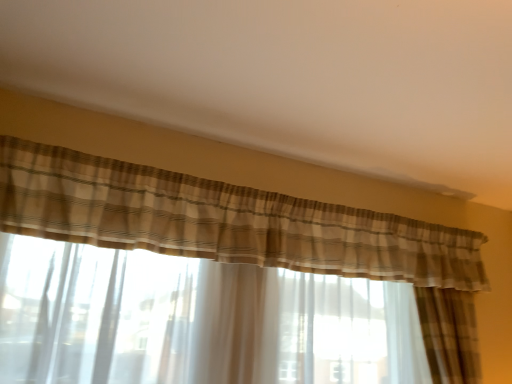
What do you see at coordinates (245, 232) in the screenshot? The height and width of the screenshot is (384, 512). I see `striped fabric curtain at center` at bounding box center [245, 232].

At what (x,y) coordinates should I click in order to perform the action: click on striped fabric curtain at center. Please return your answer as a coordinate pair (x, y). This screenshot has width=512, height=384. Looking at the image, I should click on (245, 232).

Identify the location of striped fabric curtain at center. The width and height of the screenshot is (512, 384). [x=245, y=232].